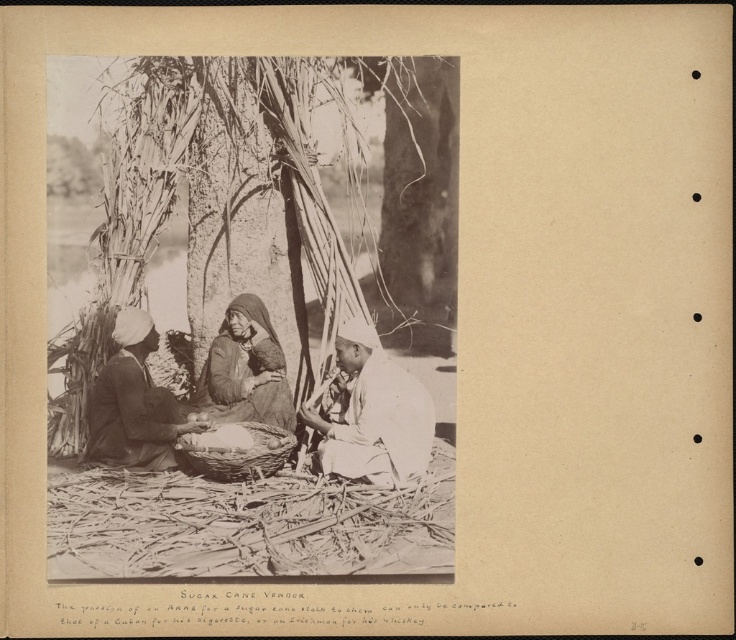
From the picture: Between dark brown fabric turban at lower left and dark brown fabric at center, which one appears on the right side from the viewer's perspective?

dark brown fabric at center

Which of these two, dark brown fabric turban at lower left or dark brown fabric at center, stands taller?

With more height is dark brown fabric turban at lower left.

What do you see at coordinates (132, 403) in the screenshot? I see `dark brown fabric turban at lower left` at bounding box center [132, 403].

Find the location of a particular element. dark brown fabric turban at lower left is located at coordinates [132, 403].

Which is above, smooth bark tree trunk at upper center or white cloth at center?

smooth bark tree trunk at upper center is above.

Does smooth bark tree trunk at upper center appear over white cloth at center?

Yes, smooth bark tree trunk at upper center is above white cloth at center.

This screenshot has width=736, height=640. I want to click on smooth bark tree trunk at upper center, so click(417, 196).

This screenshot has height=640, width=736. What do you see at coordinates (417, 196) in the screenshot? I see `smooth bark tree trunk at upper center` at bounding box center [417, 196].

Is smooth bark tree trunk at upper center smaller than dark brown fabric turban at lower left?

Actually, smooth bark tree trunk at upper center might be larger than dark brown fabric turban at lower left.

At what (x,y) coordinates should I click in order to perform the action: click on smooth bark tree trunk at upper center. Please return your answer as a coordinate pair (x, y). This screenshot has width=736, height=640. Looking at the image, I should click on (417, 196).